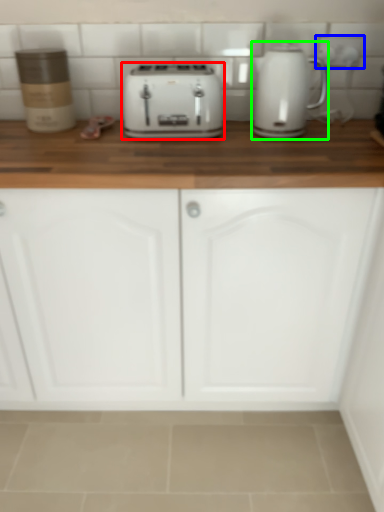
Question: Which object is the closest to the toaster (highlighted by a red box)? Choose among these: electric outlet (highlighted by a blue box) or home appliance (highlighted by a green box).

Choices:
 (A) electric outlet
 (B) home appliance

Answer: (B)